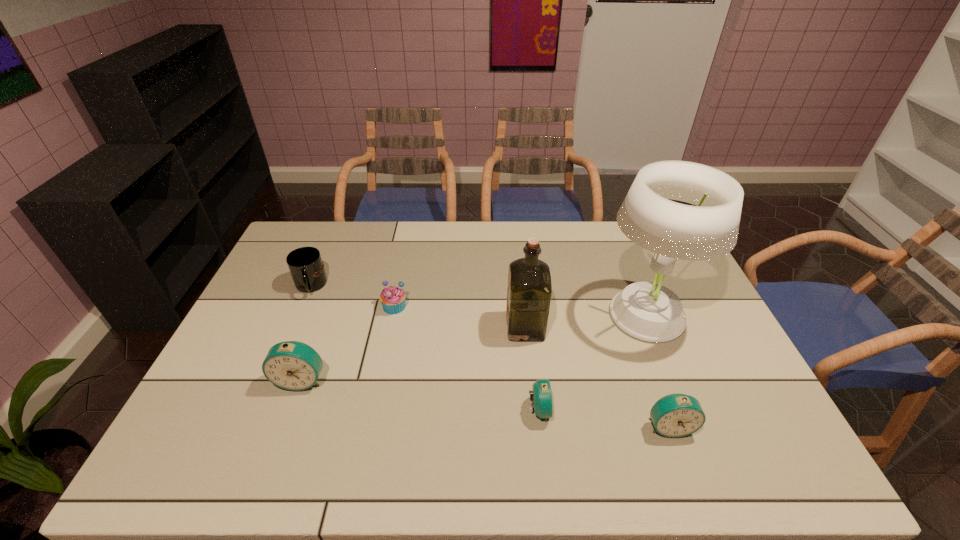
What are the coordinates of `vacant position in the image that satisfies the following two spatial constraints: 1. on the label of the second tallest object; 2. on the front-facing side of the third nearest object` in the screenshot? It's located at (531, 380).

Locate an element on the screen. free space that satisfies the following two spatial constraints: 1. on the label of the second tallest object; 2. on the front-facing side of the third nearest object is located at coordinates (531, 380).

At what (x,y) coordinates should I click in order to perform the action: click on free space that satisfies the following two spatial constraints: 1. on the front-facing side of the tallest object; 2. on the front-facing side of the second tallest alarm clock. Please return your answer as a coordinate pair (x, y). Looking at the image, I should click on (688, 426).